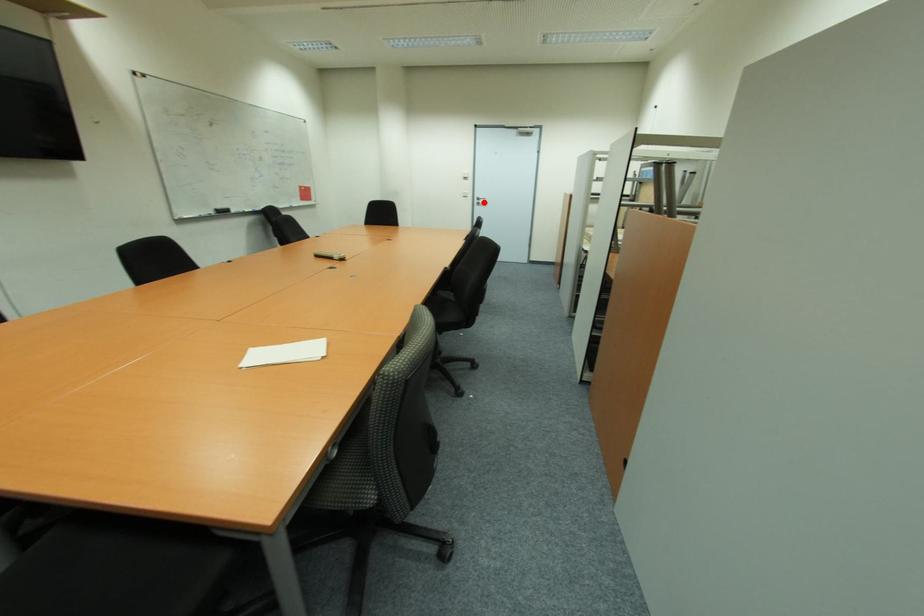
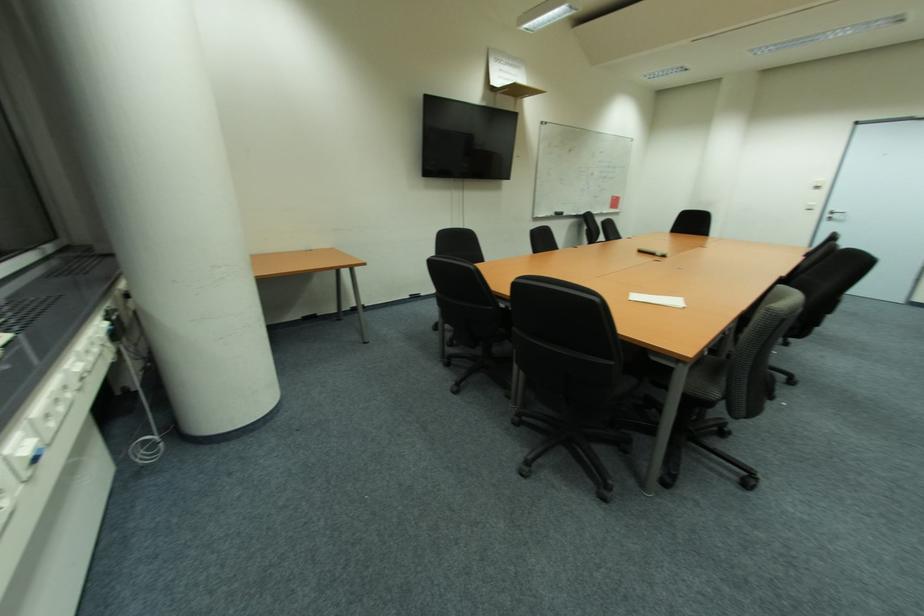
Question: I am providing you with two images of the same scene from different viewpoints. Given a red point in image1, look at the same physical point in image2. Is it:

Choices:
 (A) Closer to the viewpoint
 (B) Farther from the viewpoint

Answer: (B)